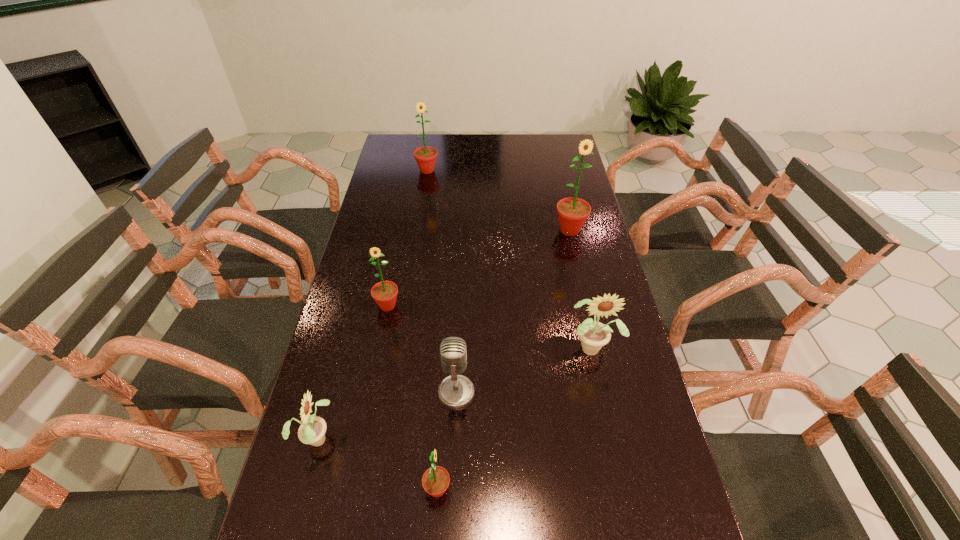
Locate an element on the screen. This screenshot has height=540, width=960. vacant region between the leftmost object and the biggest green sunflower is located at coordinates (444, 334).

The image size is (960, 540). In order to click on vacant point located between the bigger yellow sunflower and the second green sunflower from right to left in this screenshot , I will do `click(516, 418)`.

Point out which object is positioned as the fifth nearest to the fifth farthest object. Please provide its 2D coordinates. Your answer should be formatted as a tuple, i.e. [(x, y)], where the tuple contains the x and y coordinates of a point satisfying the conditions above.

[(572, 212)]

Identify which object is the fourth closest to the third nearest object. Please provide its 2D coordinates. Your answer should be formatted as a tuple, i.e. [(x, y)], where the tuple contains the x and y coordinates of a point satisfying the conditions above.

[(593, 335)]

Select which sunflower appears as the fourth closest to the right yellow sunflower. Please provide its 2D coordinates. Your answer should be formatted as a tuple, i.e. [(x, y)], where the tuple contains the x and y coordinates of a point satisfying the conditions above.

[(312, 431)]

Locate which sunflower is the second closest to the third nearest green sunflower. Please provide its 2D coordinates. Your answer should be formatted as a tuple, i.e. [(x, y)], where the tuple contains the x and y coordinates of a point satisfying the conditions above.

[(425, 156)]

Select which green sunflower appears as the fourth closest to the fifth farthest object. Please provide its 2D coordinates. Your answer should be formatted as a tuple, i.e. [(x, y)], where the tuple contains the x and y coordinates of a point satisfying the conditions above.

[(425, 156)]

Select which green sunflower is the second closest to the bigger yellow sunflower. Please provide its 2D coordinates. Your answer should be formatted as a tuple, i.e. [(x, y)], where the tuple contains the x and y coordinates of a point satisfying the conditions above.

[(435, 481)]

Locate an element on the screen. vacant point that satisfies the following two spatial constraints: 1. on the face of the farthest green sunflower; 2. on the front-facing side of the second nearest sunflower is located at coordinates pyautogui.click(x=385, y=437).